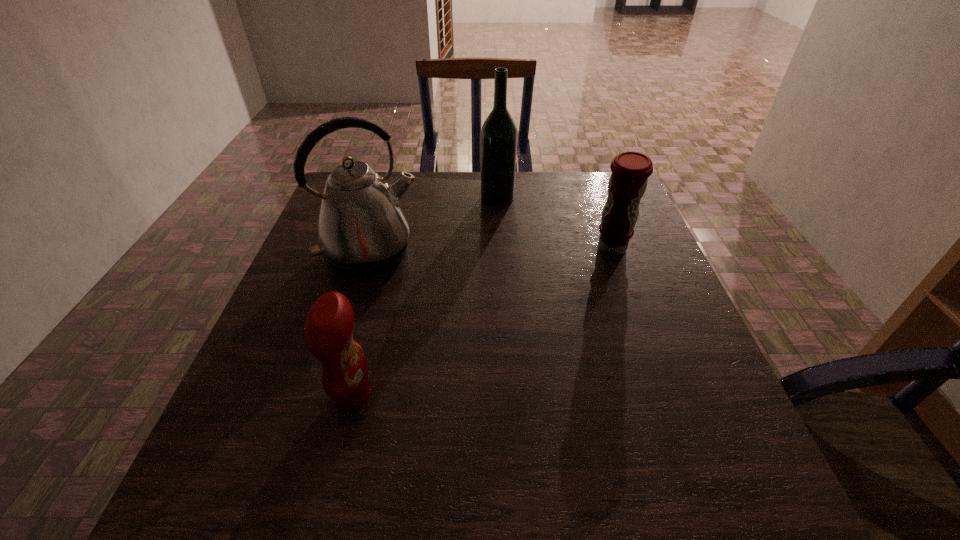
This screenshot has height=540, width=960. I want to click on the farthest object, so click(499, 133).

Find the location of a particular element. The width and height of the screenshot is (960, 540). alcohol is located at coordinates (499, 133).

Where is `kettle`? The image size is (960, 540). kettle is located at coordinates (362, 231).

You are a GUI agent. You are given a task and a screenshot of the screen. Output one action in this format:
    pyautogui.click(x=<x>, y=<y>)
    Task: Click on the rightmost object
    
    Given the screenshot: What is the action you would take?
    pyautogui.click(x=630, y=170)

The height and width of the screenshot is (540, 960). I want to click on the farther condiment, so click(630, 170).

Locate an element on the screen. The height and width of the screenshot is (540, 960). the nearest object is located at coordinates (328, 331).

Where is `the nearer condiment`? This screenshot has width=960, height=540. the nearer condiment is located at coordinates (328, 331).

The width and height of the screenshot is (960, 540). I want to click on vacant space positioned on the right of the alcohol, so click(541, 198).

This screenshot has width=960, height=540. Identify the location of vacant space located on the front of the kettle. (354, 308).

Identify the location of vacant area situated on the front of the right condiment. (647, 347).